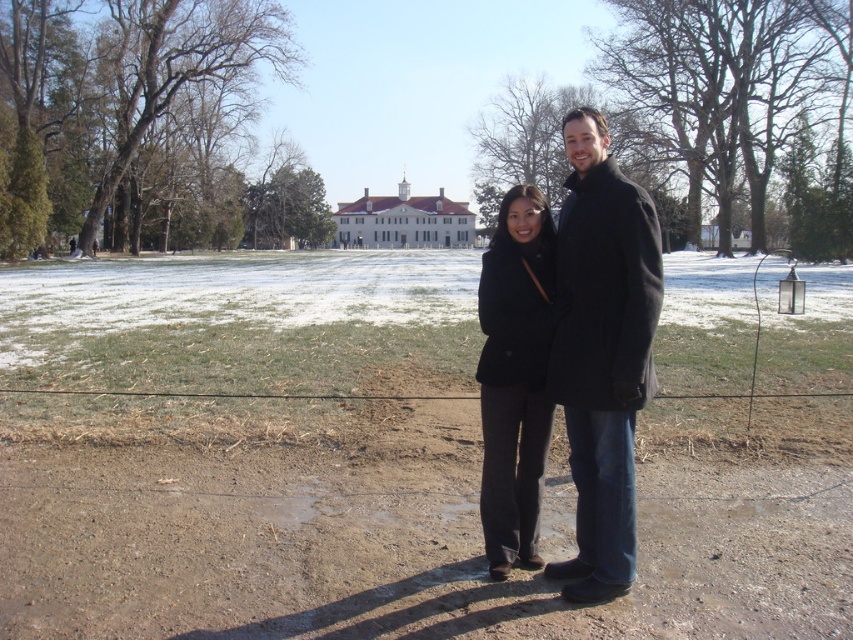
You are a photographer trying to capture both the black wool coat at center and the black matte coat at center in a single shot. Since they are both at the center, which coat would you need to focus on first to ensure it appears sharp in the photo?

The black wool coat at center is in front of the black matte coat at center, so you should focus on the black wool coat at center first to ensure it appears sharp in the photo.

You are standing at the point marked as point (602,352). What object is located exactly at your current position?

The black wool coat at center is located exactly at point (602,352).